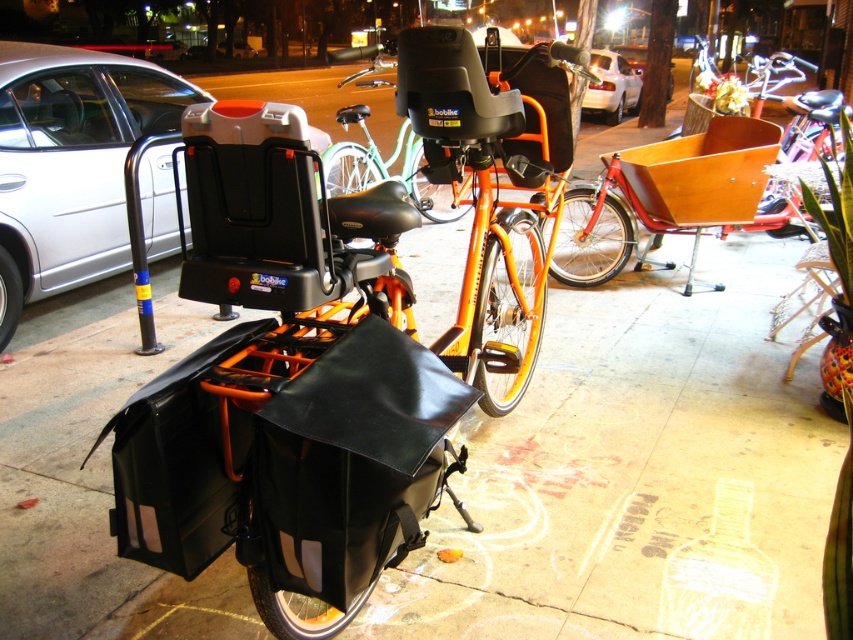
Looking at this image, you are a cyclist who wants to park your bike. You see the matte black bike rack at left and the orange matte bicycle at center. Which one is closer to you?

The matte black bike rack at left is closer to the viewer than the orange matte bicycle at center, so the matte black bike rack at left is closer to you.

You are a cyclist who just arrived at the bike rack. You see the matte black bike rack at left and the orange matte bicycle at center. Which one is positioned to the left?

The matte black bike rack at left is positioned to the left of the orange matte bicycle at center.

You are a delivery person who needs to park your vehicle on the sidewalk. The wooden cart at center and the white glossy car at upper center are already parked there. Which vehicle takes up more space on the sidewalk?

Result: The wooden cart at center takes up more space on the sidewalk because its width is larger than the white glossy car at upper center.